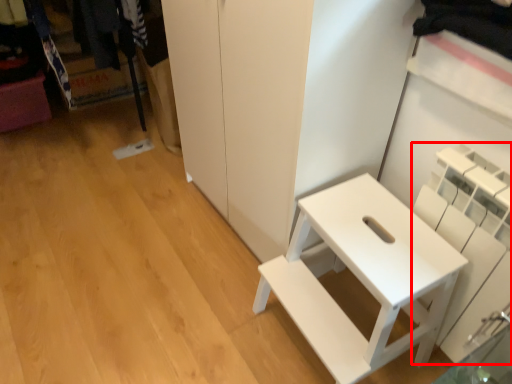
Question: From the image's perspective, where is shelf (annotated by the red box) located relative to furniture?

Choices:
 (A) below
 (B) above

Answer: (B)